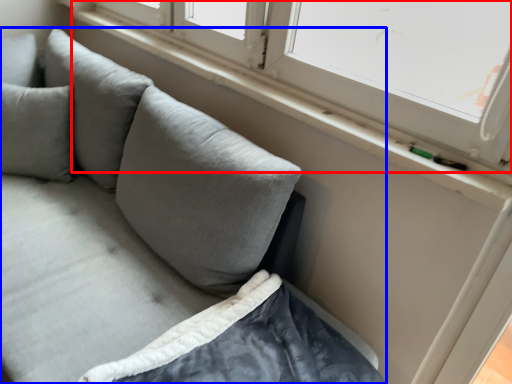
Question: Which object appears farthest to the camera in this image, window (highlighted by a red box) or studio couch (highlighted by a blue box)?

Choices:
 (A) window
 (B) studio couch

Answer: (A)